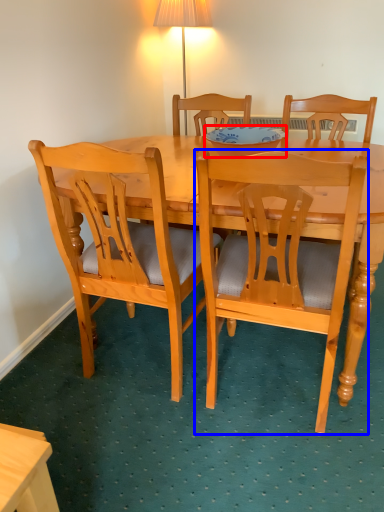
Question: Among these objects, which one is nearest to the camera, bowl (highlighted by a red box) or chair (highlighted by a blue box)?

Choices:
 (A) bowl
 (B) chair

Answer: (B)